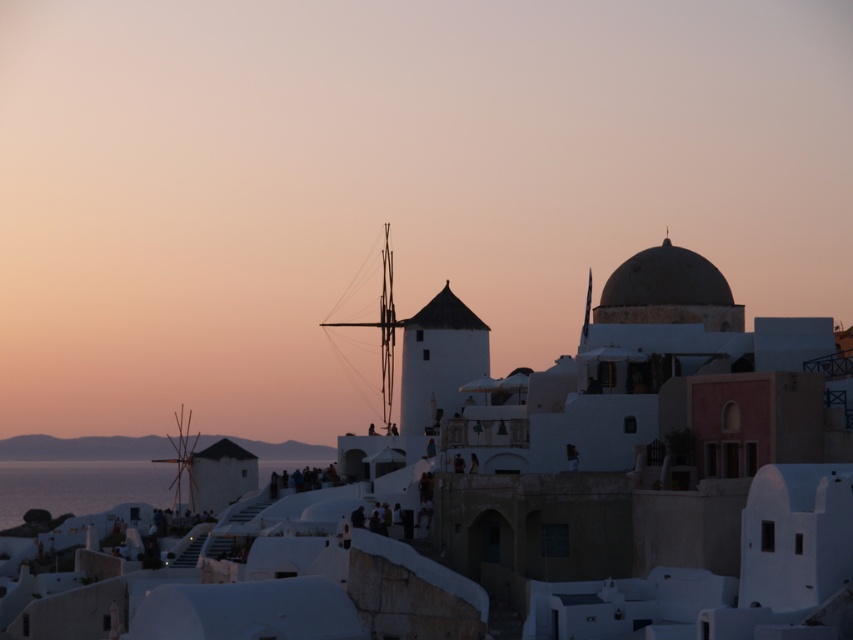
Looking at this image, is white matte building at center bigger than white matte windmill at center?

Correct, white matte building at center is larger in size than white matte windmill at center.

Can you confirm if white matte building at center is shorter than white matte windmill at center?

Incorrect, white matte building at center's height does not fall short of white matte windmill at center's.

Is point (241, 525) farther from camera compared to point (119, 440)?

No, it is not.

In order to click on white matte building at center in this screenshot , I will do `click(517, 492)`.